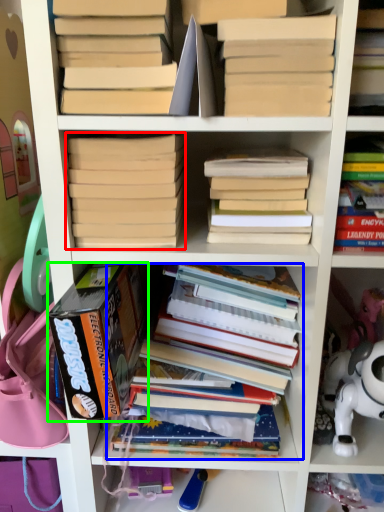
Question: Which object is positioned farthest from book (highlighted by a red box)? Select from book (highlighted by a blue box) and book (highlighted by a green box).

Choices:
 (A) book
 (B) book

Answer: (A)